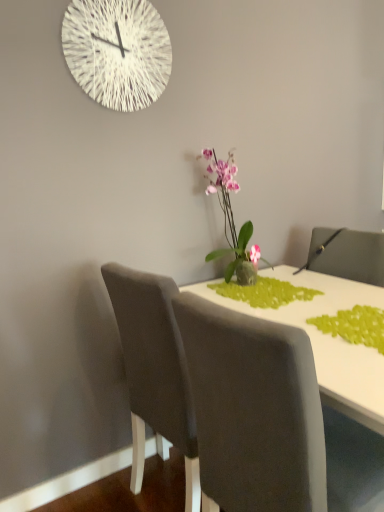
You are a GUI agent. You are given a task and a screenshot of the screen. Output one action in this format:
    pyautogui.click(x=<x>, y=<y>)
    Task: Click on the free space to the back side of green textured placemat at lower right, the second plant from the back
    This screenshot has height=512, width=384.
    Given the screenshot: What is the action you would take?
    pyautogui.click(x=343, y=297)